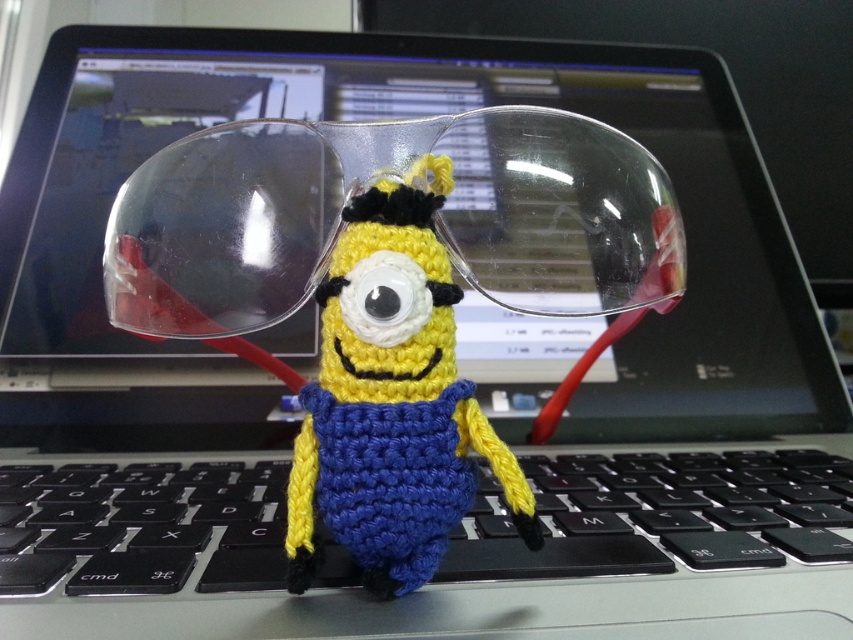
Who is positioned more to the right, transparent plastic glasses at center or yellow yarn minion at center?

yellow yarn minion at center is more to the right.

Who is higher up, transparent plastic glasses at center or yellow yarn minion at center?

Positioned higher is transparent plastic glasses at center.

Locate an element on the screen. The height and width of the screenshot is (640, 853). transparent plastic glasses at center is located at coordinates (399, 182).

The width and height of the screenshot is (853, 640). Identify the location of transparent plastic glasses at center. (399, 182).

Who is taller, black plastic keyboard at center or yellow yarn minion at center?

With more height is yellow yarn minion at center.

Between point (619, 493) and point (335, 243), which one is positioned behind?

The point (619, 493) is behind.

Find the location of a particular element. black plastic keyboard at center is located at coordinates (660, 515).

Does transparent plastic glasses at center have a lesser width compared to black plastic keyboard at center?

Correct, transparent plastic glasses at center's width is less than black plastic keyboard at center's.

Is transparent plastic glasses at center further to the viewer compared to black plastic keyboard at center?

No, transparent plastic glasses at center is in front of black plastic keyboard at center.

Is point (175, 148) in front of point (646, 531)?

Yes, it is.

Image resolution: width=853 pixels, height=640 pixels. I want to click on transparent plastic glasses at center, so click(x=399, y=182).